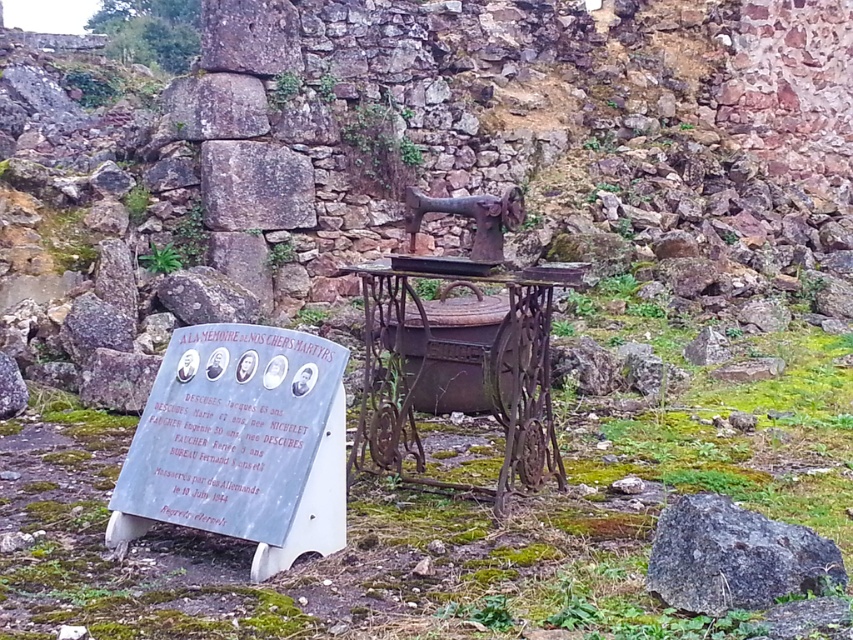
Question: Which of these objects is positioned closest to the rusty metal sewing machine at center?

Choices:
 (A) gray rough rock at lower right
 (B) gray stone plaque at center
 (C) smooth gray rock at center

Answer: (B)

Question: Is rusty metal sewing machine at center above gray rough rock at lower right?

Choices:
 (A) no
 (B) yes

Answer: (B)

Question: Can you confirm if rusty metal sewing machine at center is bigger than gray rough rock at lower right?

Choices:
 (A) yes
 (B) no

Answer: (A)

Question: Among these objects, which one is farthest from the camera?

Choices:
 (A) gray rough rock at lower right
 (B) rusty metal sewing machine at center
 (C) smooth gray rock at center

Answer: (C)

Question: Which point is farther to the camera?

Choices:
 (A) gray stone plaque at center
 (B) gray rough rock at lower right

Answer: (A)

Question: Is gray stone plaque at center positioned in front of smooth gray rock at center?

Choices:
 (A) yes
 (B) no

Answer: (A)